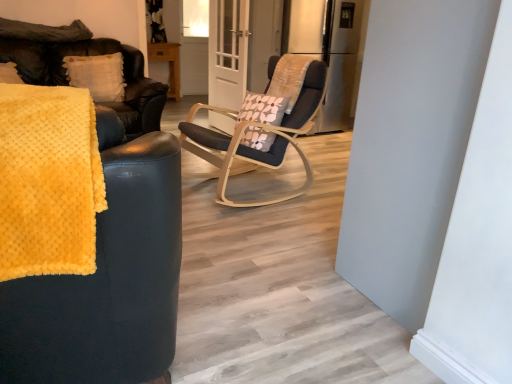
Question: Is point (138, 312) positioned closer to the camera than point (58, 87)?

Choices:
 (A) farther
 (B) closer

Answer: (A)

Question: Considering the positions of yellow fuzzy blanket at left and yellow fuzzy blanket at left in the image, is yellow fuzzy blanket at left taller or shorter than yellow fuzzy blanket at left?

Choices:
 (A) short
 (B) tall

Answer: (B)

Question: Which is nearer to the yellow fuzzy blanket at left?

Choices:
 (A) clear glass door at center
 (B) metallic refrigerator at center
 (C) yellow fuzzy blanket at left
 (D) white textured pillow at upper left

Answer: (C)

Question: Based on their relative distances, which object is nearer to the metallic refrigerator at center?

Choices:
 (A) yellow fuzzy blanket at left
 (B) clear glass door at center
 (C) white textured pillow at upper left
 (D) yellow fuzzy blanket at left

Answer: (B)